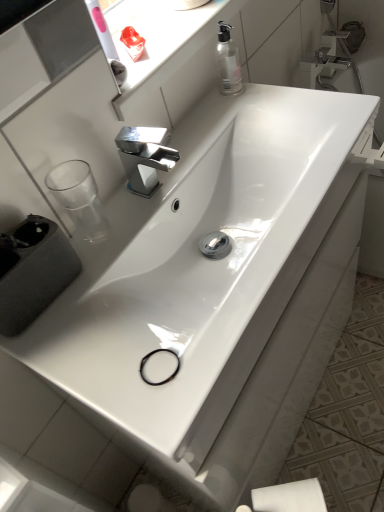
The image size is (384, 512). I want to click on polished chrome faucet at center, so click(x=145, y=156).

At what (x,y) coordinates should I click in order to perform the action: click on white matte toilet paper at lower right. Please return your answer as a coordinate pair (x, y). Looking at the image, I should click on (290, 497).

Measure the distance between point [231,57] and camera.

A distance of 38.90 inches exists between point [231,57] and camera.

What do you see at coordinates (202, 264) in the screenshot?
I see `white glossy sink at center, the first sink viewed from the front` at bounding box center [202, 264].

At what (x,y) coordinates should I click in order to perform the action: click on polished chrome faucet at center. Please return your answer as a coordinate pair (x, y). The width and height of the screenshot is (384, 512). Looking at the image, I should click on (145, 156).

Which is in front, point (171, 70) or point (265, 177)?

Positioned in front is point (171, 70).

Can we say transparent plastic window sill at upper center lies outside white glossy sink at center, the first sink viewed from the front?

transparent plastic window sill at upper center lies outside white glossy sink at center, the first sink viewed from the front,'s area.

In terms of height, does transparent plastic window sill at upper center look taller or shorter compared to white glossy sink at center, the first sink viewed from the front?

transparent plastic window sill at upper center is shorter than white glossy sink at center, the first sink viewed from the front.

Identify the location of window sill on the left of white glossy sink at center, the first sink viewed from the front. The width and height of the screenshot is (384, 512). (164, 36).

Is white matte toilet paper at lower right facing away from polished chrome faucet at center?

white matte toilet paper at lower right does not have its back to polished chrome faucet at center.

You are a GUI agent. You are given a task and a screenshot of the screen. Output one action in this format:
    pyautogui.click(x=<x>, y=<y>)
    Task: Click on the tap located on the left of white matte toilet paper at lower right
    This screenshot has width=384, height=512.
    Given the screenshot: What is the action you would take?
    pyautogui.click(x=145, y=156)

In the image, is white matte toilet paper at lower right positioned in front of or behind polished chrome faucet at center?

white matte toilet paper at lower right is in front of polished chrome faucet at center.

Can you confirm if white matte toilet paper at lower right is bigger than polished chrome faucet at center?

Indeed, white matte toilet paper at lower right has a larger size compared to polished chrome faucet at center.

How distant is white glossy sink at center, placed as the second sink when sorted from front to back, from transparent plastic window sill at upper center?

12.36 inches.

Is white glossy sink at center, placed as the second sink when sorted from front to back, far from transparent plastic window sill at upper center?

white glossy sink at center, placed as the second sink when sorted from front to back, is near transparent plastic window sill at upper center, not far away.

Can transparent plastic window sill at upper center be found inside white glossy sink at center, arranged as the 1th sink when viewed from the back?

No, transparent plastic window sill at upper center is not a part of white glossy sink at center, arranged as the 1th sink when viewed from the back.

Is transparent plastic window sill at upper center at the back of white glossy sink at center, placed as the second sink when sorted from front to back?

No.

Between transparent plastic soap dispenser at upper right and white glossy sink at center, arranged as the 1th sink when viewed from the back, which one has less height?

With less height is white glossy sink at center, arranged as the 1th sink when viewed from the back.

From the image's perspective, who appears lower, transparent plastic soap dispenser at upper right or white glossy sink at center, arranged as the 1th sink when viewed from the back?

From the image's view, white glossy sink at center, arranged as the 1th sink when viewed from the back, is below.

Does point (229, 73) come behind point (210, 359)?

Yes, point (229, 73) is behind point (210, 359).

Between transparent plastic window sill at upper center and polished chrome faucet at center, which one has larger width?

transparent plastic window sill at upper center is wider.

Is transparent plastic window sill at upper center positioned with its back to polished chrome faucet at center?

That's not correct — transparent plastic window sill at upper center is not looking away from polished chrome faucet at center.

From a real-world perspective, is transparent plastic window sill at upper center over polished chrome faucet at center?

Yes, from a real-world perspective, transparent plastic window sill at upper center is on top of polished chrome faucet at center.

Does white matte toilet paper at lower right appear on the left side of white glossy sink at center, which is the second sink from back to front?

Incorrect, white matte toilet paper at lower right is not on the left side of white glossy sink at center, which is the second sink from back to front.

This screenshot has height=512, width=384. Find the location of `toilet paper that appears above the white glossy sink at center, which is the second sink from back to front (from a real-world perspective)`. toilet paper that appears above the white glossy sink at center, which is the second sink from back to front (from a real-world perspective) is located at coordinates [290, 497].

In the scene shown: How many degrees apart are the facing directions of white matte toilet paper at lower right and white glossy sink at center, the first sink viewed from the front?

white matte toilet paper at lower right and white glossy sink at center, the first sink viewed from the front, are facing 51.6 degrees away from each other.

Does point (276, 498) appear closer or farther from the camera than point (67, 341)?

Clearly, point (276, 498) is more distant from the camera than point (67, 341).

From the image's perspective, relative to white glossy sink at center, arranged as the 1th sink when viewed from the back, is white matte toilet paper at lower right above or below?

From the image's perspective, white matte toilet paper at lower right appears below white glossy sink at center, arranged as the 1th sink when viewed from the back.

Which of these two, white matte toilet paper at lower right or white glossy sink at center, arranged as the 1th sink when viewed from the back, is thinner?

Thinner between the two is white matte toilet paper at lower right.

Measure the distance between white matte toilet paper at lower right and white glossy sink at center, placed as the second sink when sorted from front to back.

17.78 inches.

You are a GUI agent. You are given a task and a screenshot of the screen. Output one action in this format:
    pyautogui.click(x=<x>, y=<y>)
    Task: Click on the window sill behind the white glossy sink at center, which is the second sink from back to front
    This screenshot has width=384, height=512.
    Given the screenshot: What is the action you would take?
    pyautogui.click(x=164, y=36)

The height and width of the screenshot is (512, 384). Find the location of `tap that appears on the left of white matte toilet paper at lower right`. tap that appears on the left of white matte toilet paper at lower right is located at coordinates (145, 156).

Looking at the image, which one is located closer to transparent plastic window sill at upper center, transparent plastic soap dispenser at upper right or polished chrome faucet at center?

Among the two, transparent plastic soap dispenser at upper right is located nearer to transparent plastic window sill at upper center.

From the image, which object appears to be farther from transparent plastic soap dispenser at upper right, white matte toilet paper at lower right or white glossy sink at center, placed as the second sink when sorted from front to back?

Based on the image, white matte toilet paper at lower right appears to be further to transparent plastic soap dispenser at upper right.

Estimate the real-world distances between objects in this image. Which object is closer to polished chrome faucet at center, transparent plastic window sill at upper center or transparent plastic soap dispenser at upper right?

transparent plastic window sill at upper center is closer to polished chrome faucet at center.

Looking at the image, which one is located further to transparent plastic soap dispenser at upper right, white glossy sink at center, placed as the second sink when sorted from front to back, or polished chrome faucet at center?

white glossy sink at center, placed as the second sink when sorted from front to back.

In the scene shown: Which object lies further to the anchor point transparent plastic soap dispenser at upper right, white glossy sink at center, which is the second sink from back to front, or transparent plastic window sill at upper center?

Based on the image, white glossy sink at center, which is the second sink from back to front, appears to be further to transparent plastic soap dispenser at upper right.

Based on their spatial positions, is white glossy sink at center, placed as the second sink when sorted from front to back, or transparent plastic soap dispenser at upper right further from white matte toilet paper at lower right?

The object further to white matte toilet paper at lower right is transparent plastic soap dispenser at upper right.

Estimate the real-world distances between objects in this image. Which object is closer to transparent plastic soap dispenser at upper right, transparent plastic window sill at upper center or polished chrome faucet at center?

transparent plastic window sill at upper center lies closer to transparent plastic soap dispenser at upper right than the other object.

Which object lies nearer to the anchor point white glossy sink at center, the first sink viewed from the front, transparent plastic window sill at upper center or polished chrome faucet at center?

polished chrome faucet at center.

Where is `sink between transparent plastic soap dispenser at upper right and white glossy sink at center, which is the second sink from back to front, vertically`? sink between transparent plastic soap dispenser at upper right and white glossy sink at center, which is the second sink from back to front, vertically is located at coordinates (200, 252).

Identify the location of sink between white glossy sink at center, placed as the second sink when sorted from front to back, and white matte toilet paper at lower right in the up-down direction. (202, 264).

Where is `soap dispenser between transparent plastic window sill at upper center and polished chrome faucet at center vertically`? soap dispenser between transparent plastic window sill at upper center and polished chrome faucet at center vertically is located at coordinates (228, 62).

Locate an element on the screen. This screenshot has height=512, width=384. tap between transparent plastic soap dispenser at upper right and white matte toilet paper at lower right in the vertical direction is located at coordinates (145, 156).